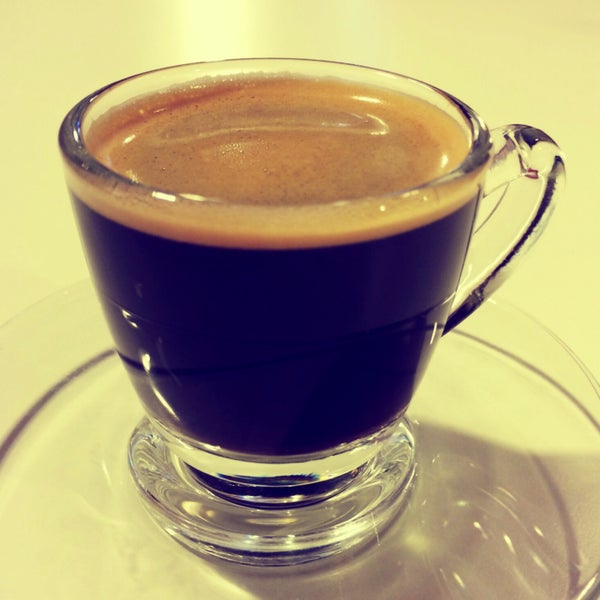
Find the location of `glass plate`. glass plate is located at coordinates (527, 489).